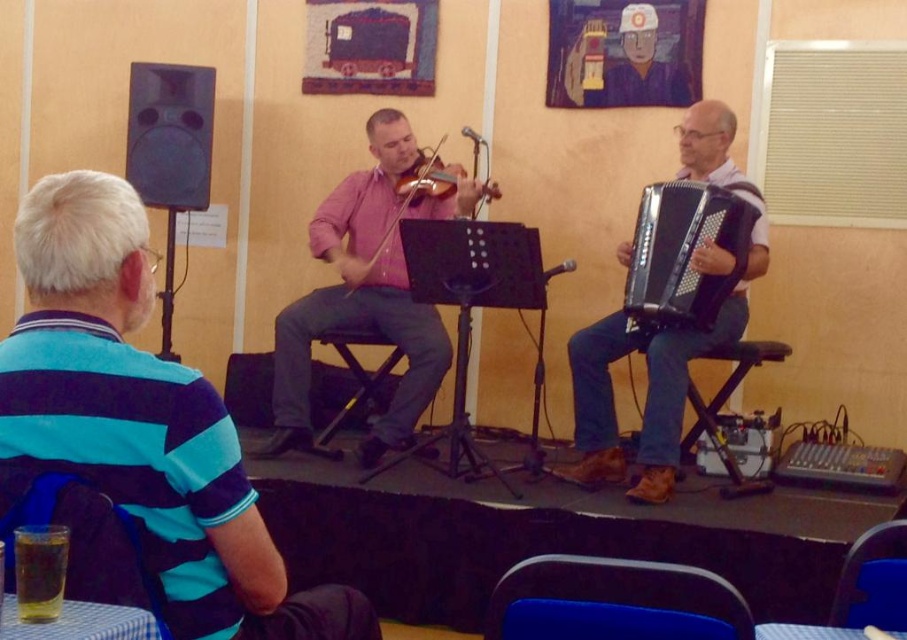
You are a stagehand standing at the back of the stage. You need to place a spotlight directly above the pink matte violinist at center. According to the coordinates provided, where should you position the spotlight?

The spotlight should be positioned directly above the coordinates point at (367, 292) where the pink matte violinist at center is located.

Looking at this image, you are standing at the point marked by the coordinates point (x=367, y=292) in the image. Looking around, you see the pink matte violinist at center and the other musician playing an instrument. Which musician is closer to your current position?

The pink matte violinist at center is closer to your current position because the point (x=367, y=292) indicates their location.